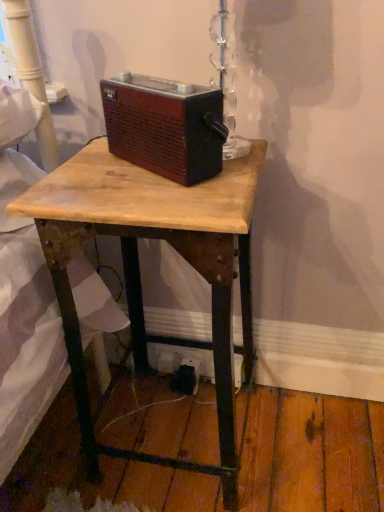
This screenshot has width=384, height=512. In order to click on free point to the right of black plastic outlet at lower center in this screenshot , I will do `click(260, 404)`.